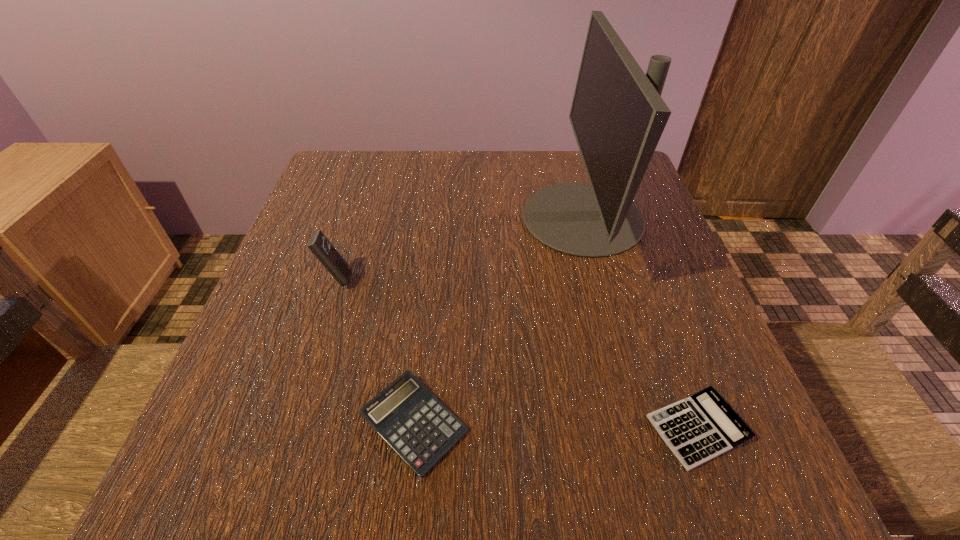
Locate an element on the screen. The width and height of the screenshot is (960, 540). vacant space at the near edge of the desktop is located at coordinates (580, 456).

The image size is (960, 540). Identify the location of vacant area at the left edge of the desktop. (282, 414).

The image size is (960, 540). In the image, there is a desktop. Identify the location of vacant area at the right edge. (659, 404).

In the image, there is a desktop. Identify the location of free space at the far left corner. The height and width of the screenshot is (540, 960). (390, 154).

Where is `free point between the third shortest object and the computer monitor`? free point between the third shortest object and the computer monitor is located at coordinates (460, 248).

At what (x,y) coordinates should I click in order to perform the action: click on vacant space that's between the computer monitor and the third shortest object. Please return your answer as a coordinate pair (x, y). The width and height of the screenshot is (960, 540). Looking at the image, I should click on (460, 248).

I want to click on free point between the shortest object and the tallest object, so click(640, 323).

I want to click on vacant area between the computer monitor and the shortest object, so click(x=640, y=323).

The image size is (960, 540). What are the coordinates of `unoccupied area between the shortest object and the computer monitor` in the screenshot? It's located at (640, 323).

Identify the location of unoccupied area between the tallest object and the rightmost calculator. (640, 323).